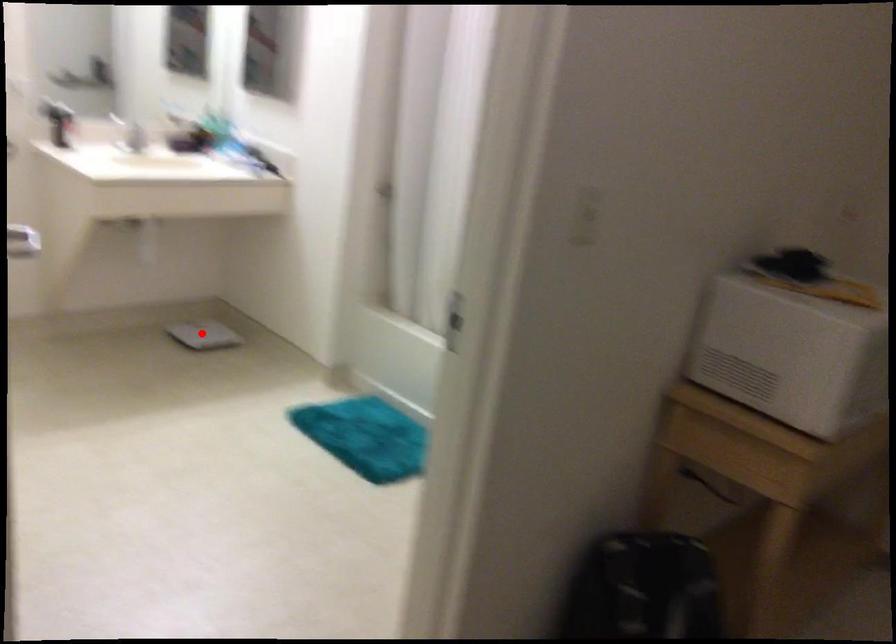
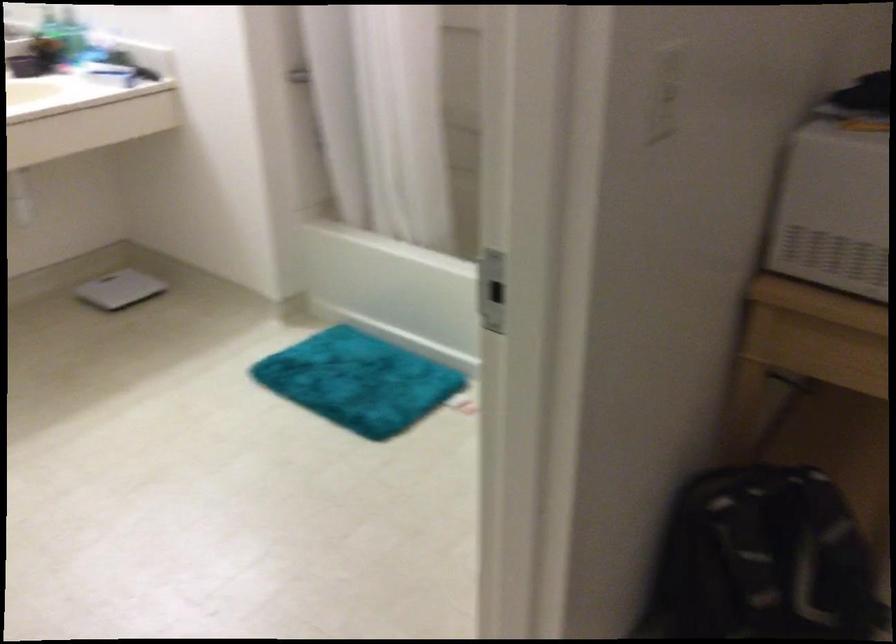
Question: I am providing you with two images of the same scene from different viewpoints. A red point is shown in image1. For the corresponding object point in image2, is it positioned nearer or farther from the camera?

Choices:
 (A) Nearer
 (B) Farther

Answer: (A)